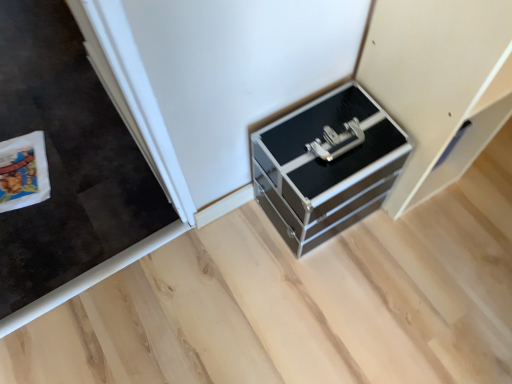
Image resolution: width=512 pixels, height=384 pixels. In order to click on space that is in front of metallic black chest of drawers at center in this screenshot , I will do `click(329, 291)`.